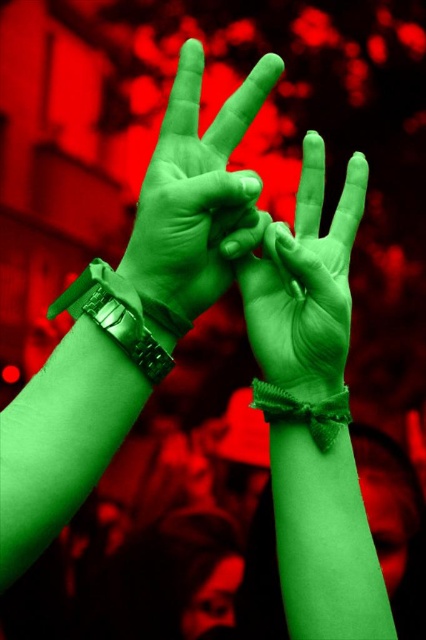
You are a photographer who wants to ensure that both the green rubber glove at center and the green knitted wristband at center are clearly visible in the photo. Given their sizes, which object might require you to adjust your camera focus to capture more detail?

The green rubber glove at center has a greater height compared to the green knitted wristband at center, so it might require adjusting the camera focus to capture more detail due to its larger size.

You are a fashion designer examining the image. You notice the green rubber wristband at center and the green rubber glove at center. Which of these items is shorter in length?

The green rubber wristband at center is shorter than the green rubber glove at center.